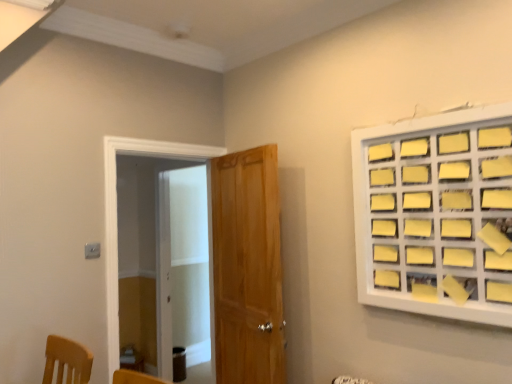
Measure the distance between point (265, 306) and camera.

Point (265, 306) and camera are 8.44 feet apart.

Measure the distance between transparent glass screen door at left and camera.

transparent glass screen door at left is 12.68 feet away from camera.

This screenshot has width=512, height=384. What do you see at coordinates (436, 214) in the screenshot?
I see `yellow paper at upper right` at bounding box center [436, 214].

Identify the location of wooden door at center. The image size is (512, 384). (247, 268).

Based on the photo, is yellow paper at upper right to the right of transparent glass screen door at left from the viewer's perspective?

Yes.

How many degrees apart are the facing directions of yellow paper at upper right and transparent glass screen door at left?

91 degrees.

Where is `window located above the transparent glass screen door at left (from the image's perspective)`? window located above the transparent glass screen door at left (from the image's perspective) is located at coordinates (436, 214).

Does yellow paper at upper right lie behind transparent glass screen door at left?

No, yellow paper at upper right is closer to the camera.

Locate an element on the screen. This screenshot has height=384, width=512. window in front of the transparent glass screen door at left is located at coordinates (436, 214).

Would you say transparent glass screen door at left contains yellow paper at upper right?

No, yellow paper at upper right is not surrounded by transparent glass screen door at left.

Which is in front, transparent glass screen door at left or yellow paper at upper right?

yellow paper at upper right is in front.

Is wooden door at center inside or outside of yellow paper at upper right?

wooden door at center is not inside yellow paper at upper right, it's outside.

From the image's perspective, is wooden door at center under yellow paper at upper right?

Indeed, from the image's perspective, wooden door at center is shown beneath yellow paper at upper right.

Is wooden door at center to the left or to the right of transparent glass screen door at left in the image?

From the image, it's evident that wooden door at center is to the right of transparent glass screen door at left.

In terms of height, does wooden door at center look taller or shorter compared to transparent glass screen door at left?

Clearly, wooden door at center is shorter compared to transparent glass screen door at left.

Is point (262, 344) closer or farther from the camera than point (206, 221)?

Point (262, 344) is positioned closer to the camera compared to point (206, 221).

Is wooden door at center turned away from transparent glass screen door at left?

No, wooden door at center is not facing the opposite direction of transparent glass screen door at left.

Is yellow paper at upper right behind wooden door at center?

No, it is in front of wooden door at center.

Can you tell me how much yellow paper at upper right and wooden door at center differ in facing direction?

9.72 degrees.

Looking at this image, can you confirm if yellow paper at upper right is wider than wooden door at center?

In fact, yellow paper at upper right might be narrower than wooden door at center.

Does yellow paper at upper right turn towards wooden door at center?

No, yellow paper at upper right is not facing towards wooden door at center.

From the picture: Does transparent glass screen door at left have a greater height compared to wooden door at center?

Yes.

Is transparent glass screen door at left not near wooden door at center?

transparent glass screen door at left is far away from wooden door at center.

Considering the relative sizes of transparent glass screen door at left and wooden door at center in the image provided, is transparent glass screen door at left smaller than wooden door at center?

Yes, transparent glass screen door at left is smaller than wooden door at center.

Considering the positions of point (181, 300) and point (244, 315), is point (181, 300) closer or farther from the camera than point (244, 315)?

Point (181, 300).

Where is `screen door below the yellow paper at upper right (from the image's perspective)`? The height and width of the screenshot is (384, 512). screen door below the yellow paper at upper right (from the image's perspective) is located at coordinates (164, 261).

At what (x,y) coordinates should I click in order to perform the action: click on window in front of the transparent glass screen door at left. Please return your answer as a coordinate pair (x, y). The image size is (512, 384). Looking at the image, I should click on (436, 214).

Based on their spatial positions, is yellow paper at upper right or wooden door at center further from transparent glass screen door at left?

yellow paper at upper right.

Consider the image. Estimate the real-world distances between objects in this image. Which object is further from transparent glass screen door at left, wooden door at center or yellow paper at upper right?

yellow paper at upper right.

From the image, which object appears to be nearer to yellow paper at upper right, wooden door at center or transparent glass screen door at left?

Based on the image, wooden door at center appears to be nearer to yellow paper at upper right.

Estimate the real-world distances between objects in this image. Which object is closer to wooden door at center, transparent glass screen door at left or yellow paper at upper right?

yellow paper at upper right.

Looking at this image, which object lies nearer to the anchor point wooden door at center, yellow paper at upper right or transparent glass screen door at left?

yellow paper at upper right lies closer to wooden door at center than the other object.

Based on their spatial positions, is transparent glass screen door at left or wooden door at center closer to yellow paper at upper right?

wooden door at center is positioned closer to the anchor yellow paper at upper right.

Image resolution: width=512 pixels, height=384 pixels. Identify the location of door situated between transparent glass screen door at left and yellow paper at upper right from left to right. (247, 268).